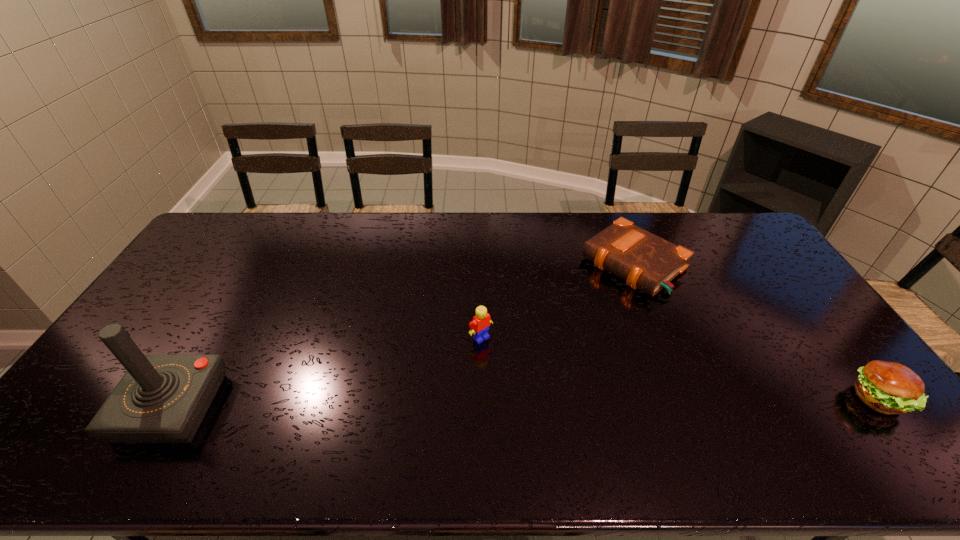
Where is `vacant space that satisfies the following two spatial constraints: 1. on the front side of the hamburger; 2. on the right side of the farthest object`? vacant space that satisfies the following two spatial constraints: 1. on the front side of the hamburger; 2. on the right side of the farthest object is located at coordinates (686, 399).